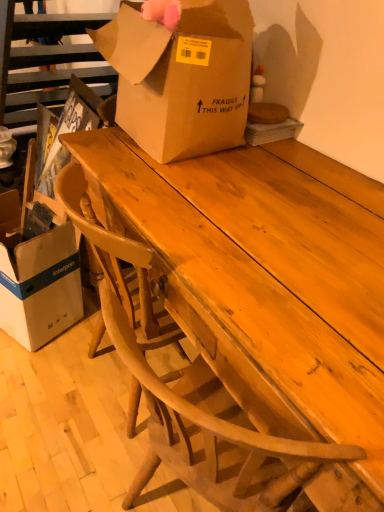
Question: Is wooden table at center surrounded by white cardboard box at lower left, marked as the 2th box in a right-to-left arrangement?

Choices:
 (A) yes
 (B) no

Answer: (B)

Question: Is white cardboard box at lower left, which ranks as the second box in top-to-bottom order, thinner than wooden table at center?

Choices:
 (A) yes
 (B) no

Answer: (A)

Question: Could you tell me if white cardboard box at lower left, which ranks as the second box in top-to-bottom order, is turned towards wooden table at center?

Choices:
 (A) no
 (B) yes

Answer: (A)

Question: Can you confirm if white cardboard box at lower left, marked as the 2th box in a right-to-left arrangement, is wider than wooden table at center?

Choices:
 (A) no
 (B) yes

Answer: (A)

Question: Can you confirm if white cardboard box at lower left, marked as the 2th box in a right-to-left arrangement, is shorter than wooden table at center?

Choices:
 (A) yes
 (B) no

Answer: (A)

Question: Can you confirm if white cardboard box at lower left, marked as the 2th box in a right-to-left arrangement, is smaller than wooden table at center?

Choices:
 (A) no
 (B) yes

Answer: (B)

Question: From the image's perspective, is brown cardboard box at center, which ranks as the 2th box in left-to-right order, located above white cardboard box at lower left, the first box positioned from the left?

Choices:
 (A) yes
 (B) no

Answer: (A)

Question: Does brown cardboard box at center, which ranks as the 2th box in left-to-right order, come behind white cardboard box at lower left, the first box positioned from the left?

Choices:
 (A) yes
 (B) no

Answer: (B)

Question: From a real-world perspective, is brown cardboard box at center, placed as the first box when sorted from right to left, below white cardboard box at lower left, marked as the 2th box in a right-to-left arrangement?

Choices:
 (A) no
 (B) yes

Answer: (A)

Question: Is brown cardboard box at center, placed as the first box when sorted from right to left, positioned before white cardboard box at lower left, marked as the 2th box in a right-to-left arrangement?

Choices:
 (A) yes
 (B) no

Answer: (A)

Question: Is white cardboard box at lower left, the first box positioned from the left, completely or partially inside brown cardboard box at center, which ranks as the 2th box in left-to-right order?

Choices:
 (A) no
 (B) yes

Answer: (A)

Question: Is brown cardboard box at center, which ranks as the 2th box in left-to-right order, bigger than white cardboard box at lower left, which ranks as the first box in bottom-to-top order?

Choices:
 (A) no
 (B) yes

Answer: (B)

Question: Would you say wooden table at center is part of brown cardboard box at center, the 2th box ordered from the bottom,'s contents?

Choices:
 (A) no
 (B) yes

Answer: (A)